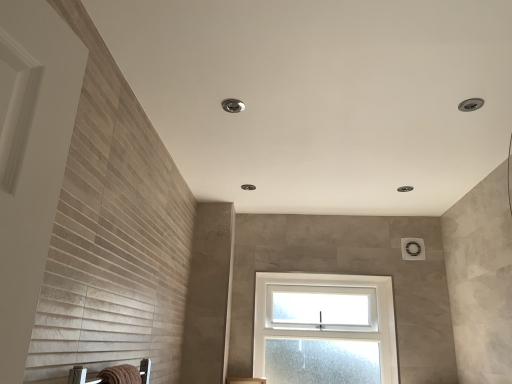
Question: Is brown textured towel at lower left in front of or behind clear glass window at center in the image?

Choices:
 (A) front
 (B) behind

Answer: (A)

Question: From a real-world perspective, is brown textured towel at lower left positioned above or below clear glass window at center?

Choices:
 (A) below
 (B) above

Answer: (A)

Question: Visually, is brown textured towel at lower left positioned to the left or to the right of clear glass window at center?

Choices:
 (A) left
 (B) right

Answer: (A)

Question: From the image's perspective, is clear glass window at center positioned above or below brown textured towel at lower left?

Choices:
 (A) above
 (B) below

Answer: (B)

Question: In terms of width, does clear glass window at center look wider or thinner when compared to brown textured towel at lower left?

Choices:
 (A) wide
 (B) thin

Answer: (A)

Question: Which is correct: clear glass window at center is inside brown textured towel at lower left, or outside of it?

Choices:
 (A) inside
 (B) outside

Answer: (B)

Question: Considering their positions, is clear glass window at center located in front of or behind brown textured towel at lower left?

Choices:
 (A) front
 (B) behind

Answer: (B)